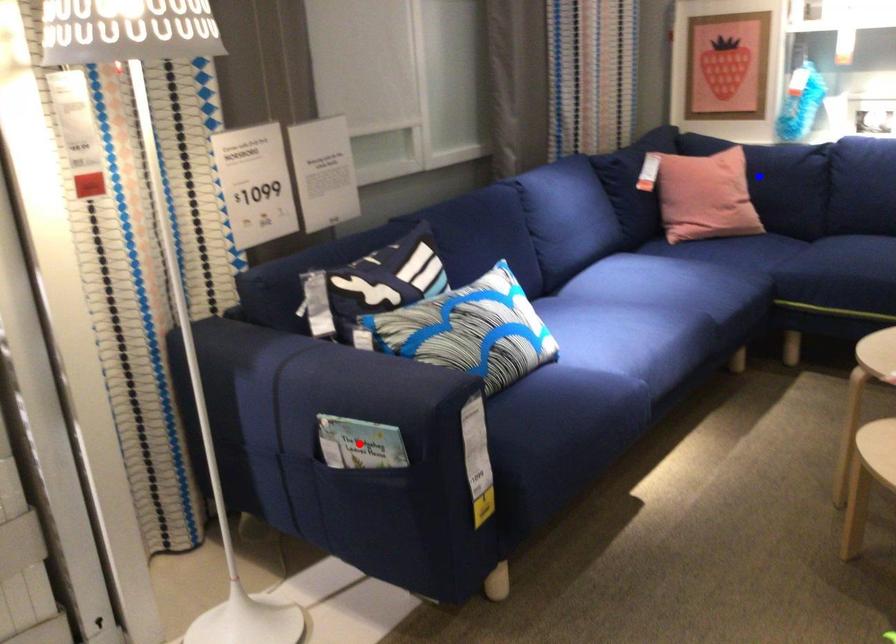
Question: Which of the two points in the image is closer to the camera?

Choices:
 (A) Blue point is closer.
 (B) Red point is closer.

Answer: (B)